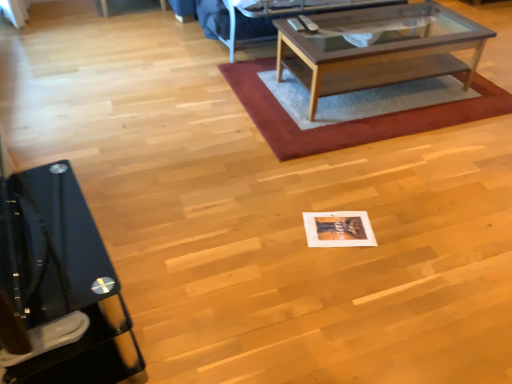
The height and width of the screenshot is (384, 512). Identify the location of spots to the right of black glossy desk at left. (187, 306).